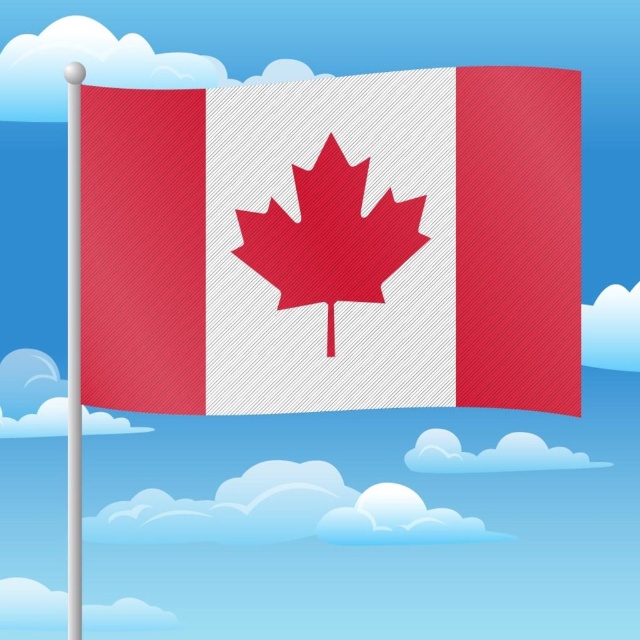
Looking at this image, you are an observer looking at the Canadian flag scene. You notice the textured fabric flag at center and the white fluffy cloud at upper right. Which object is positioned to the left of the other?

The textured fabric flag at center is to the left of the white fluffy cloud at upper right.

You are a photographer trying to capture the Canadian flag against the sky. You notice the silver metallic flag pole at left and the white fluffy cloud at lower left in your frame. Which object is positioned more to the left side of the image?

The white fluffy cloud at lower left is positioned more to the left side of the image because the silver metallic flag pole at left is to the right of it.